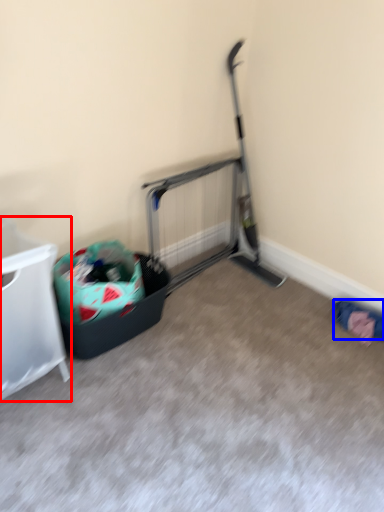
Question: Which of the following is the closest to the observer, furniture (highlighted by a red box) or clothing (highlighted by a blue box)?

Choices:
 (A) furniture
 (B) clothing

Answer: (A)